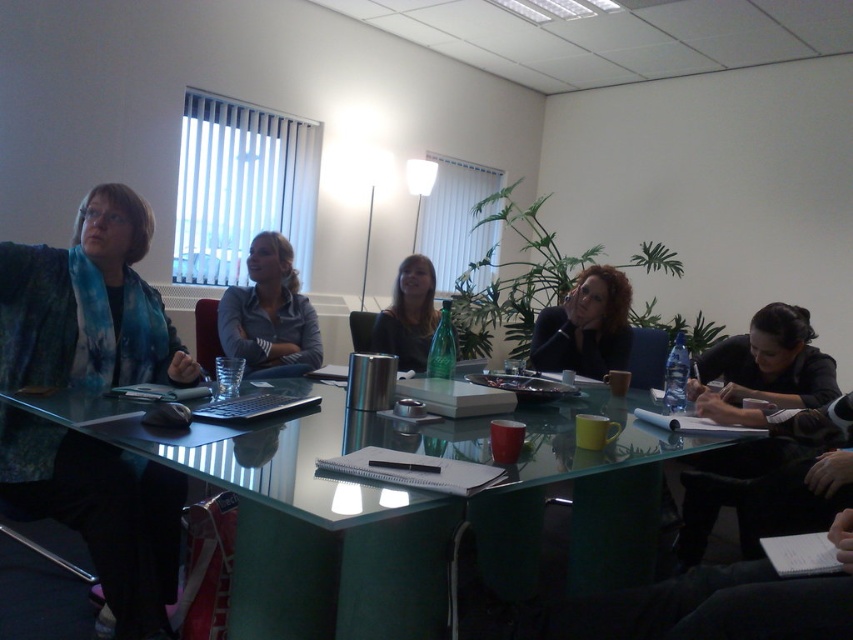
Question: Can you confirm if blue tie-dye scarf at left is smaller than dark brown hair at center?

Choices:
 (A) yes
 (B) no

Answer: (B)

Question: Which point is farther to the camera?

Choices:
 (A) matte black hair at center
 (B) blue tie-dye scarf at left
 (C) black glossy hair at lower right

Answer: (A)

Question: Where is blue tie-dye scarf at left located in relation to dark brown hair at center in the image?

Choices:
 (A) right
 (B) left

Answer: (B)

Question: Which is farther from the dark brown hair at center?

Choices:
 (A) matte black hair at center
 (B) transparent glass table at center

Answer: (B)

Question: Estimate the real-world distances between objects in this image. Which object is farther from the blue tie-dye scarf at left?

Choices:
 (A) transparent glass table at center
 (B) black glossy hair at lower right

Answer: (B)

Question: Is the position of blue tie-dye scarf at left more distant than that of matte blue shirt at center?

Choices:
 (A) yes
 (B) no

Answer: (B)